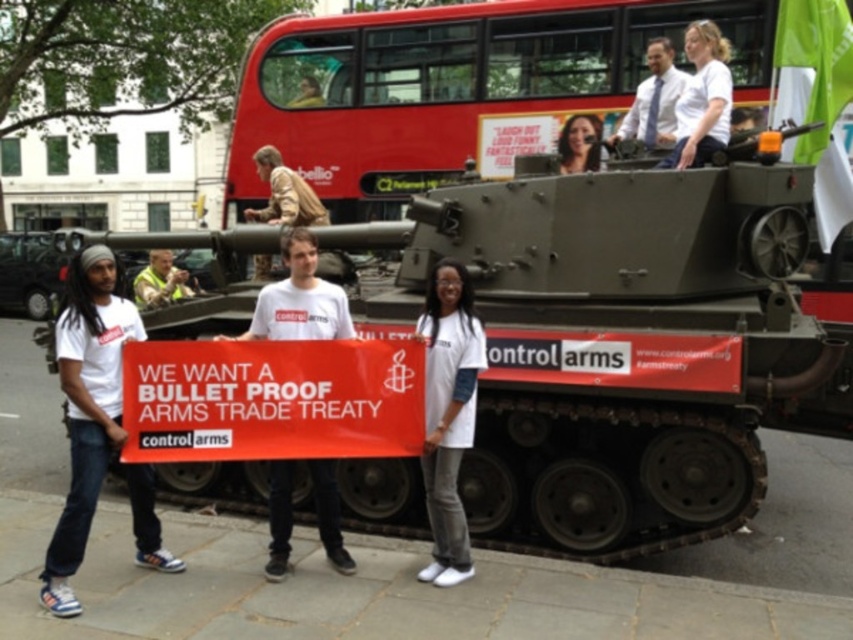
You are a photographer trying to capture a clear photo of the yellow reflective vest at center without the white cotton shirt at upper center blocking it. What should you do?

Move your camera position to the side so that the white cotton shirt at upper center no longer blocks the yellow reflective vest at center.